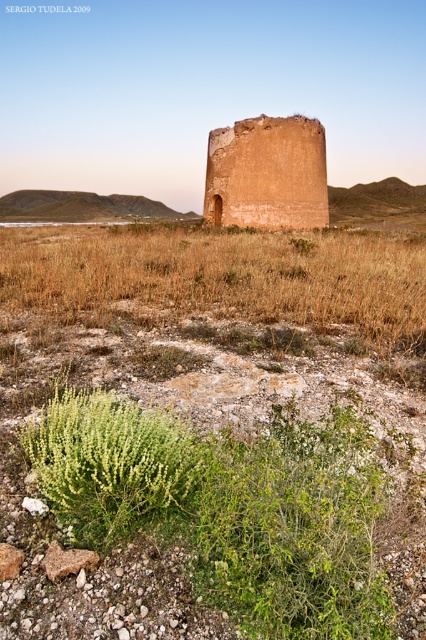
Question: Which object is farther from the camera taking this photo?

Choices:
 (A) green leafy bush at lower left
 (B) earthy clay tower at center

Answer: (B)

Question: Which point appears farthest from the camera in this image?

Choices:
 (A) click(296, 134)
 (B) click(51, 429)

Answer: (A)

Question: Observing the image, what is the correct spatial positioning of green leafy bush at lower left in reference to earthy clay tower at center?

Choices:
 (A) below
 (B) above

Answer: (A)

Question: Does green leafy bush at lower left have a lesser width compared to earthy clay tower at center?

Choices:
 (A) yes
 (B) no

Answer: (B)

Question: Is green leafy bush at lower left above earthy clay tower at center?

Choices:
 (A) yes
 (B) no

Answer: (B)